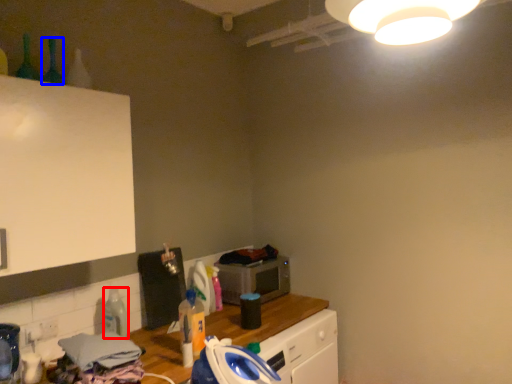
Question: Among these objects, which one is farthest to the camera, bottle (highlighted by a red box) or bottle (highlighted by a blue box)?

Choices:
 (A) bottle
 (B) bottle

Answer: (A)